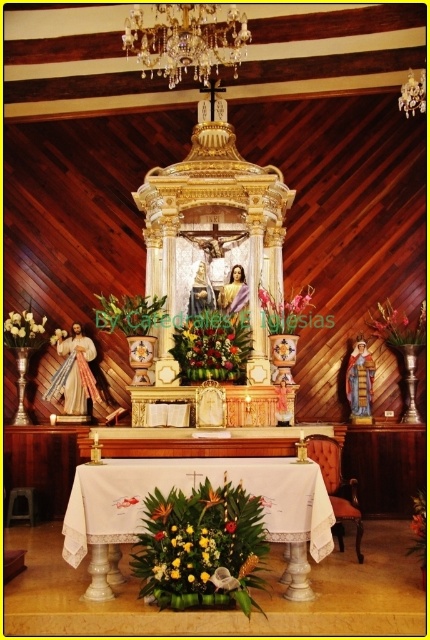
Question: Does vibrant floral bouquet at center appear over yellow fabric flower at center?

Choices:
 (A) yes
 (B) no

Answer: (A)

Question: Does vibrant floral bouquet at center have a greater width compared to green leafy plant at center?

Choices:
 (A) no
 (B) yes

Answer: (B)

Question: Which object appears closest to the camera in this image?

Choices:
 (A) yellow matte flower at center
 (B) white lace tablecloth at center
 (C) yellow fabric flower at center

Answer: (C)

Question: Which point is closer to the camera?

Choices:
 (A) (193, 358)
 (B) (205, 579)

Answer: (B)

Question: In this image, where is vibrant floral bouquet at center located relative to yellow matte flower at center?

Choices:
 (A) left
 (B) right

Answer: (A)

Question: Which object appears closest to the camera in this image?

Choices:
 (A) yellow matte flower at center
 (B) vibrant floral bouquet at center
 (C) white lace tablecloth at center

Answer: (B)